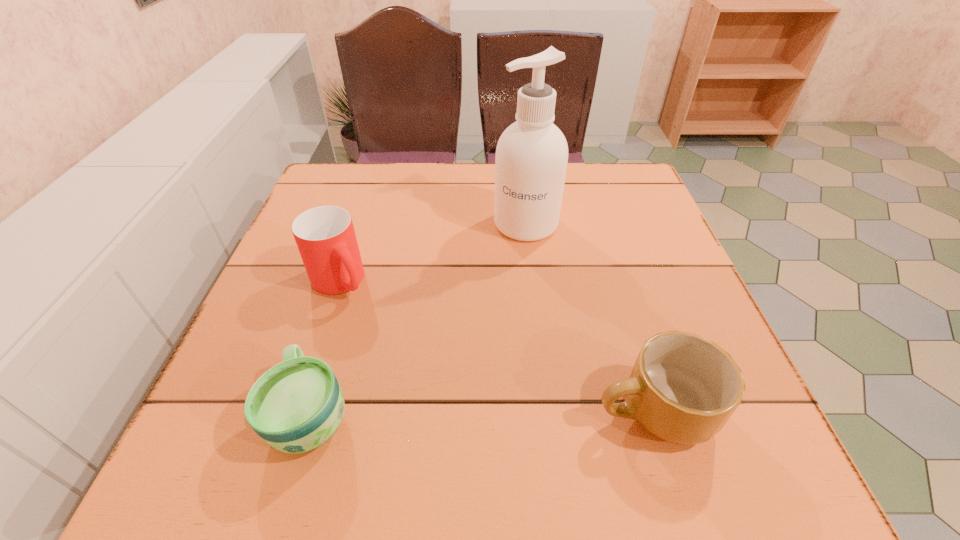
Find the location of a particular element. The height and width of the screenshot is (540, 960). free space on the desktop that is between the nearer cup and the mug and is positioned on the front label of the cleansing agent is located at coordinates (471, 412).

Find the location of a particular element. The image size is (960, 540). free spot on the desktop that is between the nearer cup and the mug and is positioned on the side of the farther cup with the handle is located at coordinates (452, 412).